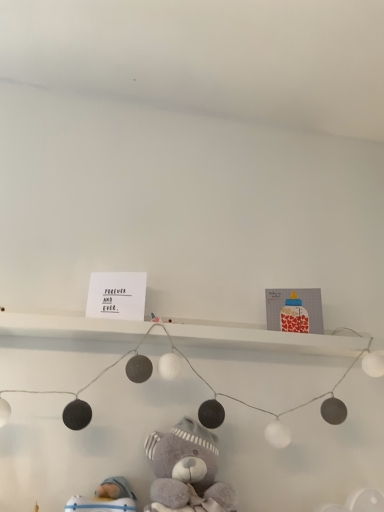
Question: Is fluffy gray teddy bear at lower center placed right next to blue fabric toy at lower left?

Choices:
 (A) yes
 (B) no

Answer: (B)

Question: Is blue fabric toy at lower left at the back of fluffy gray teddy bear at lower center?

Choices:
 (A) yes
 (B) no

Answer: (B)

Question: Is fluffy gray teddy bear at lower center far away from blue fabric toy at lower left?

Choices:
 (A) no
 (B) yes

Answer: (A)

Question: Would you say fluffy gray teddy bear at lower center contains blue fabric toy at lower left?

Choices:
 (A) no
 (B) yes

Answer: (A)

Question: Does fluffy gray teddy bear at lower center have a lesser height compared to blue fabric toy at lower left?

Choices:
 (A) no
 (B) yes

Answer: (A)

Question: Considering the relative sizes of fluffy gray teddy bear at lower center and blue fabric toy at lower left in the image provided, is fluffy gray teddy bear at lower center bigger than blue fabric toy at lower left?

Choices:
 (A) yes
 (B) no

Answer: (A)

Question: Is blue fabric toy at lower left turned away from fluffy gray teddy bear at lower center?

Choices:
 (A) yes
 (B) no

Answer: (B)

Question: Could you tell me if blue fabric toy at lower left is facing fluffy gray teddy bear at lower center?

Choices:
 (A) no
 (B) yes

Answer: (A)

Question: Is blue fabric toy at lower left not within fluffy gray teddy bear at lower center?

Choices:
 (A) no
 (B) yes

Answer: (B)

Question: Can you confirm if blue fabric toy at lower left is shorter than fluffy gray teddy bear at lower center?

Choices:
 (A) no
 (B) yes

Answer: (B)

Question: Is blue fabric toy at lower left positioned far away from fluffy gray teddy bear at lower center?

Choices:
 (A) yes
 (B) no

Answer: (B)

Question: Can you confirm if blue fabric toy at lower left is smaller than fluffy gray teddy bear at lower center?

Choices:
 (A) no
 (B) yes

Answer: (B)

Question: Considering the positions of fluffy gray teddy bear at lower center and blue fabric toy at lower left in the image, is fluffy gray teddy bear at lower center taller or shorter than blue fabric toy at lower left?

Choices:
 (A) tall
 (B) short

Answer: (A)